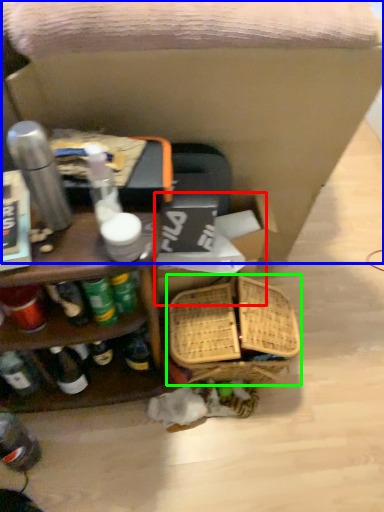
Question: Estimate the real-world distances between objects in this image. Which object is farther from storage box (highlighted by a red box), swivel chair (highlighted by a blue box) or basket (highlighted by a green box)?

Choices:
 (A) swivel chair
 (B) basket

Answer: (A)